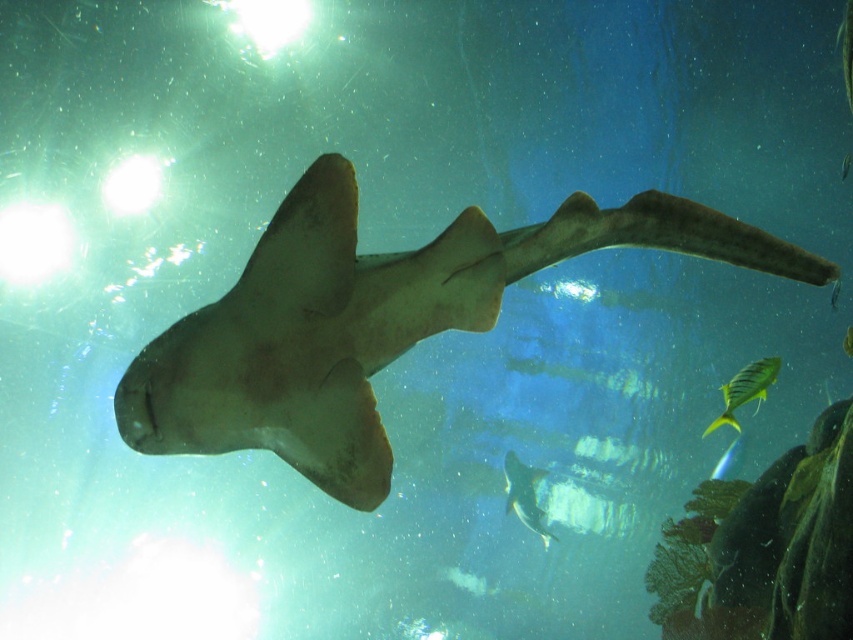
Who is higher up, smooth tan shark at center or yellow-green striped fish at lower right?

smooth tan shark at center

Between smooth tan shark at center and yellow-green striped fish at lower right, which one has less height?

Standing shorter between the two is yellow-green striped fish at lower right.

Does point (234, 340) come farther from viewer compared to point (761, 390)?

No, (234, 340) is closer to viewer.

This screenshot has height=640, width=853. What are the coordinates of `smooth tan shark at center` in the screenshot? It's located at (373, 321).

Who is more forward, (x=543, y=513) or (x=756, y=381)?

Point (x=756, y=381)

Looking at this image, is shiny silver fish at center below yellow-green striped fish at lower right?

Yes.

Is point (519, 493) closer to viewer compared to point (749, 372)?

No.

Identify the location of shiny silver fish at center. The image size is (853, 640). (524, 493).

Based on the photo, does smooth tan shark at center have a greater height compared to shiny silver fish at center?

Incorrect, smooth tan shark at center's height is not larger of shiny silver fish at center's.

Who is positioned more to the left, smooth tan shark at center or shiny silver fish at center?

From the viewer's perspective, smooth tan shark at center appears more on the left side.

Measure the distance between point (213, 390) and camera.

They are 1.73 meters apart.

You are a GUI agent. You are given a task and a screenshot of the screen. Output one action in this format:
    pyautogui.click(x=<x>, y=<y>)
    Task: Click on the smooth tan shark at center
    This screenshot has width=853, height=640.
    Given the screenshot: What is the action you would take?
    pyautogui.click(x=373, y=321)